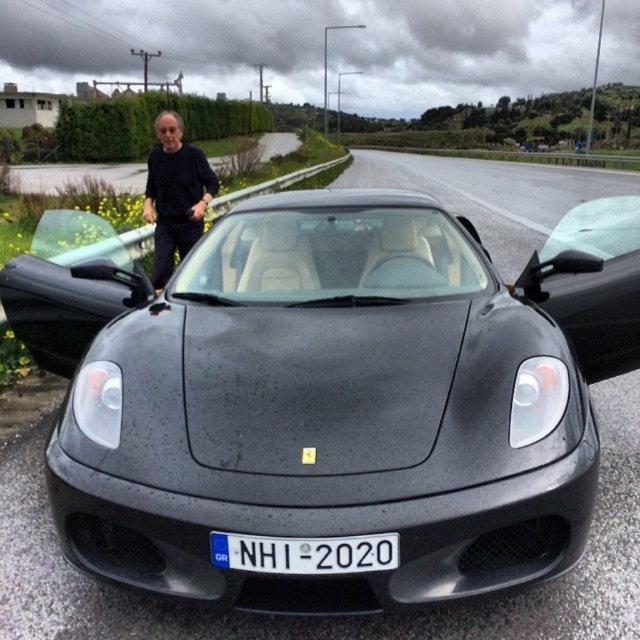
Consider the image. You are a photographer trying to capture the black matte shirt at left and the white plastic license plate at center in a single frame. Which object should you focus on first if you want to ensure both are in focus without adjusting the camera settings?

The black matte shirt at left should be focused on first because it is larger in size compared to the white plastic license plate at center, making it easier to achieve focus on the larger object first.

You are a photographer taking a picture of the glossy black sports car at center and the white plastic license plate at center. Which object is positioned higher in the image?

The glossy black sports car at center is positioned higher than the white plastic license plate at center.